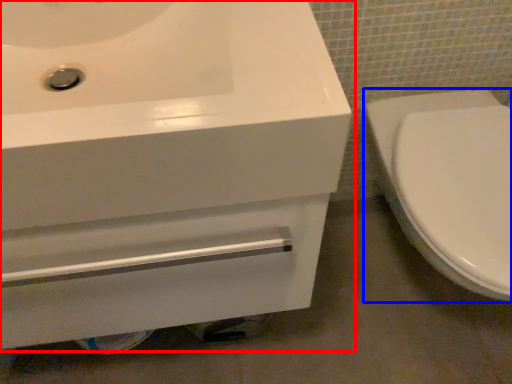
Question: Which point is further to the camera, sink (highlighted by a red box) or toilet (highlighted by a blue box)?

Choices:
 (A) sink
 (B) toilet

Answer: (B)